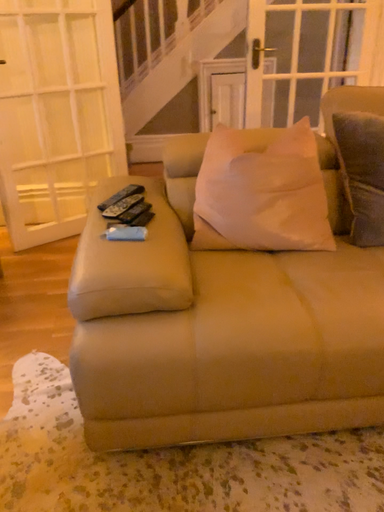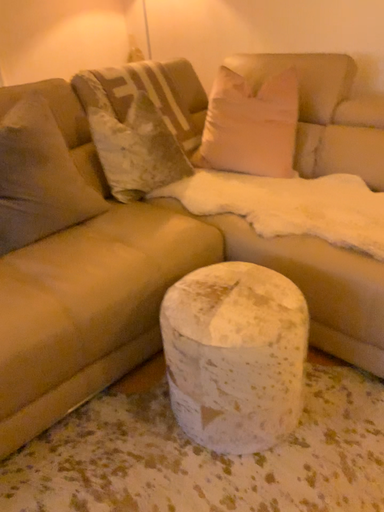
Question: How did the camera likely rotate when shooting the video?

Choices:
 (A) rotated downward
 (B) rotated upward

Answer: (B)